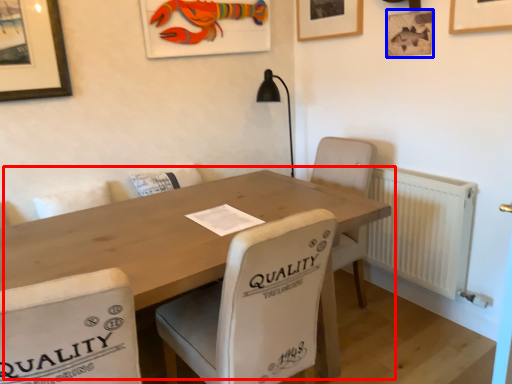
Question: Which object is closer to the camera taking this photo, table (highlighted by a red box) or picture frame (highlighted by a blue box)?

Choices:
 (A) table
 (B) picture frame

Answer: (A)